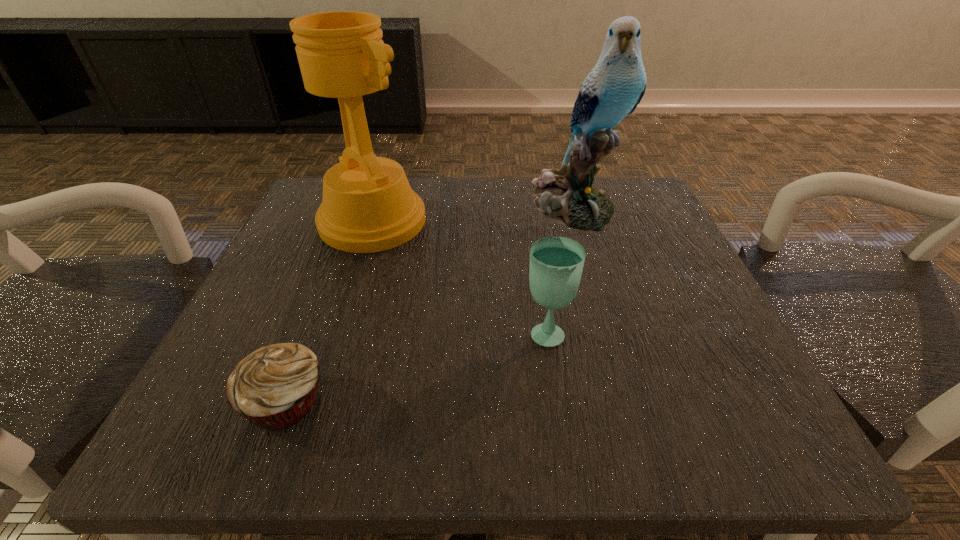
At what (x,y) coordinates should I click in order to perform the action: click on parakeet. Please return your answer as a coordinate pair (x, y). Looking at the image, I should click on (615, 86).

Identify the location of award. (368, 206).

Find the location of a particular element. The image size is (960, 540). the third tallest object is located at coordinates (556, 263).

The width and height of the screenshot is (960, 540). What are the coordinates of `glass` in the screenshot? It's located at (556, 263).

Locate an element on the screen. the shortest object is located at coordinates (274, 387).

Where is `muffin`? Image resolution: width=960 pixels, height=540 pixels. muffin is located at coordinates (274, 387).

Find the location of a particular element. This screenshot has width=960, height=540. vacant space positioned 0.130m on the face of the parakeet is located at coordinates (594, 280).

The height and width of the screenshot is (540, 960). What are the coordinates of `vacant space located 0.070m on the front of the award` in the screenshot? It's located at (354, 279).

This screenshot has height=540, width=960. What are the coordinates of `blank space located 0.120m on the back of the third farthest object` in the screenshot? It's located at (537, 266).

I want to click on free space located on the right of the shortest object, so tap(435, 401).